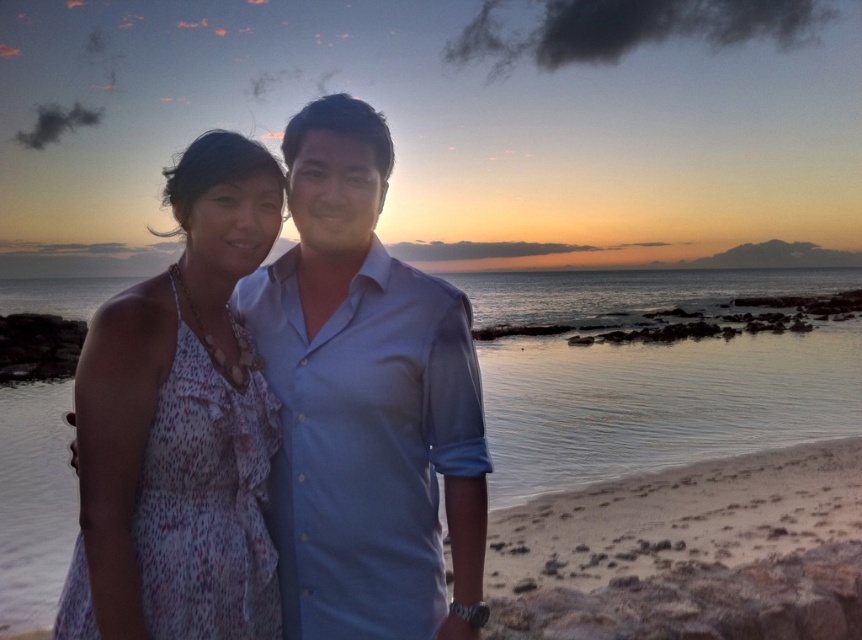
You are a photographer trying to capture the sunset at the beach. You notice the light blue shirt at center and the clear water at center. Which object is shorter in height?

The light blue shirt at center has a lesser height compared to clear water at center, so the light blue shirt at center is shorter in height.

You are a photographer trying to capture the two people in the image. The light blue shirt at center and the white dotted dress at left are your subjects. Based on their positions, which subject is positioned higher in the frame?

The light blue shirt at center is located above the white dotted dress at left, so the light blue shirt at center is positioned higher in the frame.

Consider the image. You are a photographer trying to capture the two subjects in the scene. Since the light blue shirt at center and the clear water at center are both at the center, which one should you focus on to ensure the subject in front is sharp?

The light blue shirt at center is closer to the viewer than the clear water at center, so focusing on the light blue shirt at center will ensure the subject in front is sharp.